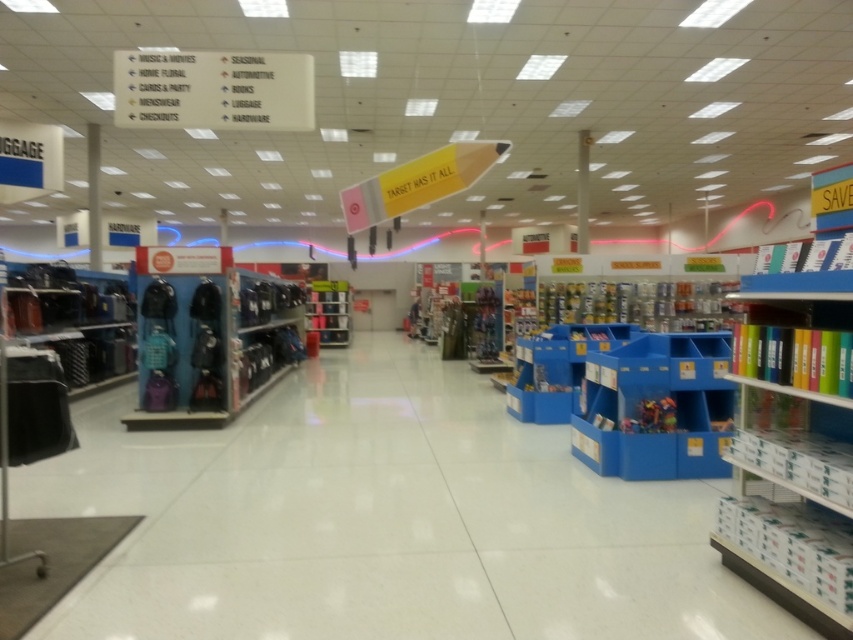
You are a customer in the store and want to find the blue plastic bin at center. Which side of the metallic silver shelf at center should you look on?

The blue plastic bin at center is positioned on the right side of the metallic silver shelf at center, so you should look to the right side of the metallic silver shelf at center.

You are a customer in the store and want to reach an item on the metallic silver shelf at center. There is a blue plastic bin at center in the way. Can you move the bin to access the shelf?

The blue plastic bin at center is below the metallic silver shelf at center, so the bin is under the shelf and cannot block access to it. You can reach the metallic silver shelf at center without moving the bin.

You are standing in the retail store and want to take a photo of the two points marked in the image. Which point, point [167,406] or point [107,316], will appear larger in your camera view?

Point [167,406] will appear larger in your camera view because it is closer to the camera than point [107,316].